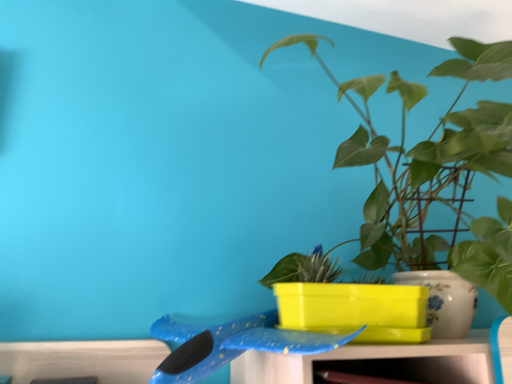
Question: Does blue glossy whale at center have a smaller size compared to green glossy plant at upper right?

Choices:
 (A) no
 (B) yes

Answer: (B)

Question: Does blue glossy whale at center have a larger size compared to green glossy plant at upper right?

Choices:
 (A) no
 (B) yes

Answer: (A)

Question: Is blue glossy whale at center further to the viewer compared to green glossy plant at upper right?

Choices:
 (A) yes
 (B) no

Answer: (A)

Question: Can you confirm if blue glossy whale at center is shorter than green glossy plant at upper right?

Choices:
 (A) yes
 (B) no

Answer: (A)

Question: Is blue glossy whale at center to the right of green glossy plant at upper right from the viewer's perspective?

Choices:
 (A) yes
 (B) no

Answer: (B)

Question: Is blue glossy whale at center far away from green glossy plant at upper right?

Choices:
 (A) yes
 (B) no

Answer: (B)

Question: From the image's perspective, is green glossy plant at upper right under blue glossy whale at center?

Choices:
 (A) no
 (B) yes

Answer: (A)

Question: Can you confirm if green glossy plant at upper right is shorter than blue glossy whale at center?

Choices:
 (A) yes
 (B) no

Answer: (B)

Question: Does green glossy plant at upper right contain blue glossy whale at center?

Choices:
 (A) yes
 (B) no

Answer: (B)

Question: Is green glossy plant at upper right next to blue glossy whale at center and touching it?

Choices:
 (A) no
 (B) yes

Answer: (A)

Question: Is green glossy plant at upper right behind blue glossy whale at center?

Choices:
 (A) no
 (B) yes

Answer: (A)

Question: Is green glossy plant at upper right oriented away from blue glossy whale at center?

Choices:
 (A) no
 (B) yes

Answer: (A)

Question: From the image's perspective, is green glossy plant at upper right located above or below blue glossy whale at center?

Choices:
 (A) above
 (B) below

Answer: (A)